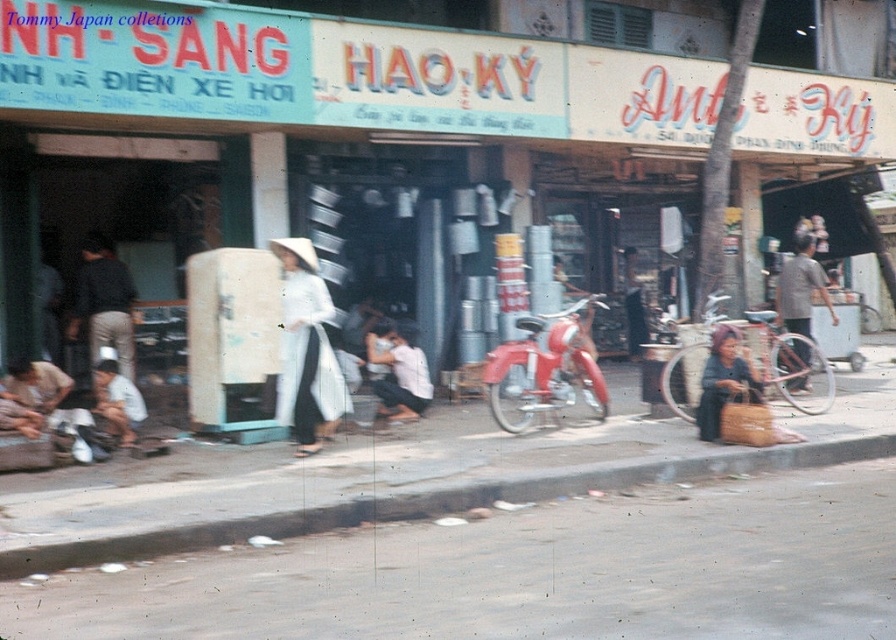
Looking at this image, you are standing on the street in the market scene. You see a point marked at coordinates (470, 532). What type of surface is this point located on?

The point (470, 532) is on smooth concrete pavement at center.

You are a photographer standing on the street and want to capture both the metallic silver canisters at center and the white fabric dress at center in a single shot. Which object should you focus on first to ensure both are in frame?

You should focus on the metallic silver canisters at center first since it is in front of the white fabric dress at center, ensuring both are captured in the frame.